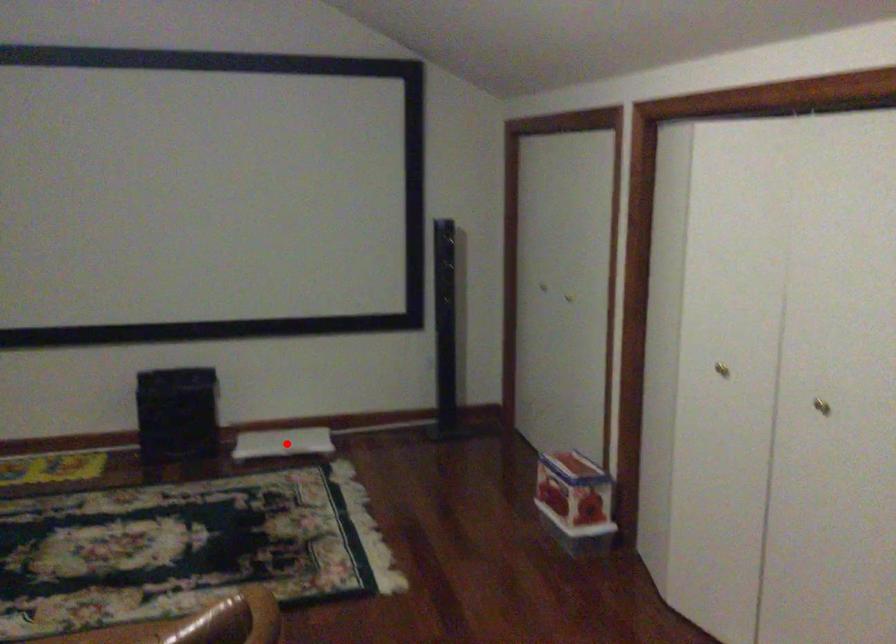
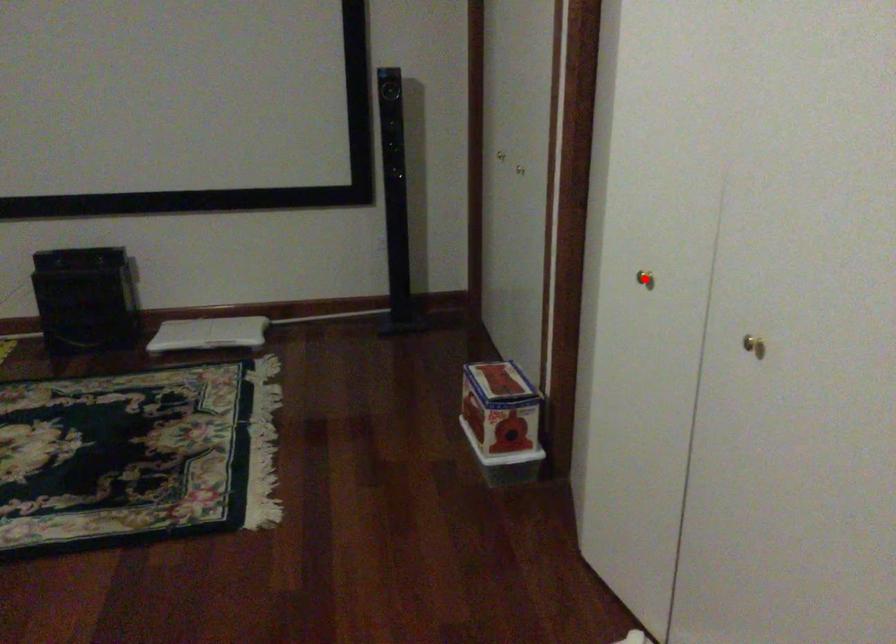
I am providing you with two images of the same scene from different viewpoints. A red point is marked on the first image and another point is marked on the second image. Does the point marked in image1 correspond to the same location as the one in image2?

No